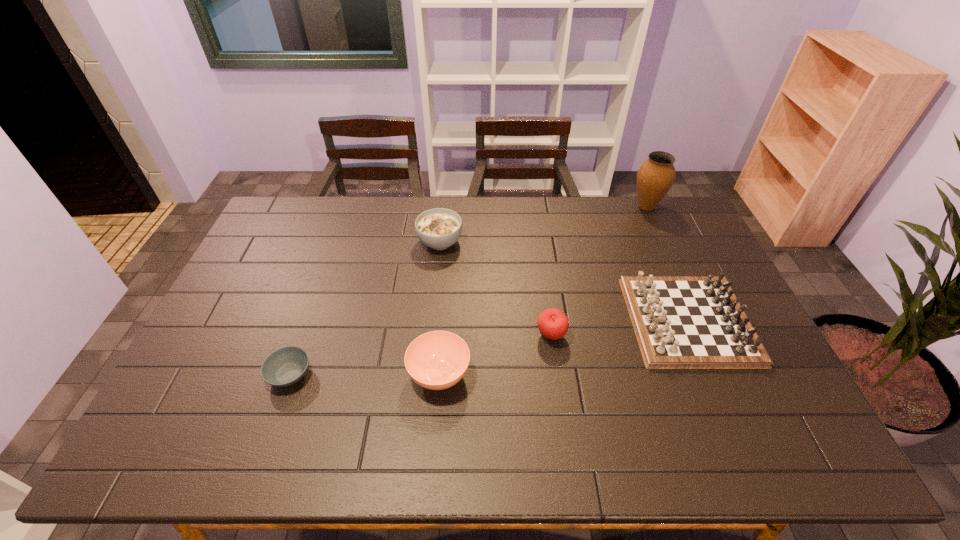
The height and width of the screenshot is (540, 960). I want to click on empty space between the second tallest soup bowl and the tallest soup bowl, so click(440, 308).

Locate an element on the screen. The image size is (960, 540). free space between the second tallest soup bowl and the fifth nearest object is located at coordinates (440, 308).

At what (x,y) coordinates should I click in order to perform the action: click on vacant area between the chessboard and the second shortest soup bowl. Please return your answer as a coordinate pair (x, y). This screenshot has width=960, height=540. Looking at the image, I should click on (564, 347).

You are a GUI agent. You are given a task and a screenshot of the screen. Output one action in this format:
    pyautogui.click(x=<x>, y=<y>)
    Task: Click on the free space between the chessboard and the apple
    This screenshot has height=540, width=960.
    Given the screenshot: What is the action you would take?
    pyautogui.click(x=619, y=328)

The width and height of the screenshot is (960, 540). In order to click on free space that is in between the shortest soup bowl and the tallest soup bowl in this screenshot , I will do `click(365, 308)`.

Locate an element on the screen. The image size is (960, 540). vacant area that lies between the tallest soup bowl and the chessboard is located at coordinates (564, 281).

Identify the location of unoccupied area between the second tallest soup bowl and the fourth object from left to right. (495, 355).

The height and width of the screenshot is (540, 960). What are the coordinates of `the fifth closest object to the chessboard` in the screenshot? It's located at (285, 366).

I want to click on the fourth closest object to the urn, so click(x=437, y=360).

You are a GUI agent. You are given a task and a screenshot of the screen. Output one action in this format:
    pyautogui.click(x=<x>, y=<y>)
    Task: Click on the second closest soup bowl to the leftmost soup bowl
    
    Given the screenshot: What is the action you would take?
    pyautogui.click(x=439, y=228)